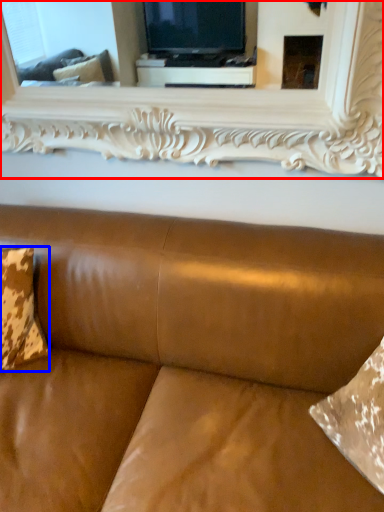
Question: Which object is closer to the camera taking this photo, mirror (highlighted by a red box) or pillow (highlighted by a blue box)?

Choices:
 (A) mirror
 (B) pillow

Answer: (A)